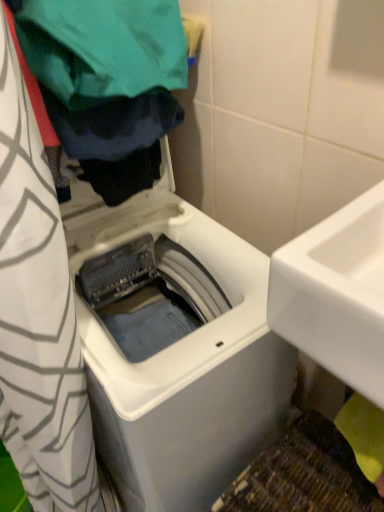
Question: Is green fabric at upper left to the left of white glossy sink at right from the viewer's perspective?

Choices:
 (A) no
 (B) yes

Answer: (B)

Question: Does green fabric at upper left appear on the right side of white glossy sink at right?

Choices:
 (A) no
 (B) yes

Answer: (A)

Question: Is green fabric at upper left facing towards white glossy sink at right?

Choices:
 (A) yes
 (B) no

Answer: (B)

Question: Is green fabric at upper left outside of white glossy sink at right?

Choices:
 (A) yes
 (B) no

Answer: (A)

Question: Is green fabric at upper left bigger than white glossy sink at right?

Choices:
 (A) yes
 (B) no

Answer: (A)

Question: Considering the positions of white glossy sink at right and white plastic washing machine at center in the image, is white glossy sink at right taller or shorter than white plastic washing machine at center?

Choices:
 (A) tall
 (B) short

Answer: (B)

Question: Looking at the image, does white glossy sink at right seem bigger or smaller compared to white plastic washing machine at center?

Choices:
 (A) small
 (B) big

Answer: (A)

Question: Is point (362, 384) closer or farther from the camera than point (97, 301)?

Choices:
 (A) closer
 (B) farther

Answer: (A)

Question: In terms of width, does white glossy sink at right look wider or thinner when compared to white plastic washing machine at center?

Choices:
 (A) thin
 (B) wide

Answer: (A)

Question: Considering the positions of green fabric at upper left and white glossy sink at right in the image, is green fabric at upper left taller or shorter than white glossy sink at right?

Choices:
 (A) short
 (B) tall

Answer: (A)

Question: In the image, is green fabric at upper left on the left side or the right side of white glossy sink at right?

Choices:
 (A) right
 (B) left

Answer: (B)

Question: Which is correct: green fabric at upper left is inside white glossy sink at right, or outside of it?

Choices:
 (A) inside
 (B) outside

Answer: (B)

Question: From the image's perspective, is green fabric at upper left positioned above or below white glossy sink at right?

Choices:
 (A) below
 (B) above

Answer: (B)

Question: Considering the positions of white glossy sink at right and green fabric at upper left in the image, is white glossy sink at right bigger or smaller than green fabric at upper left?

Choices:
 (A) small
 (B) big

Answer: (A)

Question: From their relative heights in the image, would you say white glossy sink at right is taller or shorter than green fabric at upper left?

Choices:
 (A) tall
 (B) short

Answer: (A)